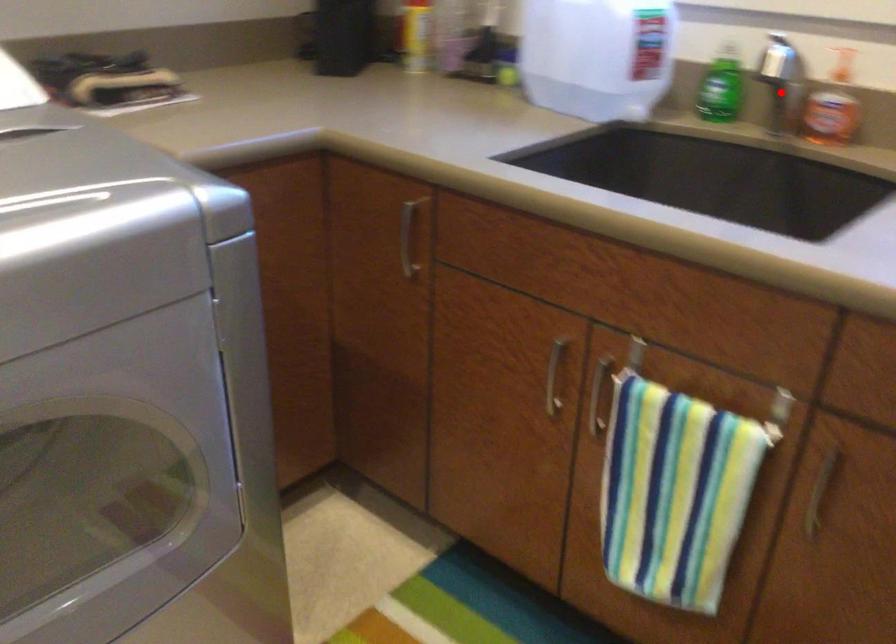
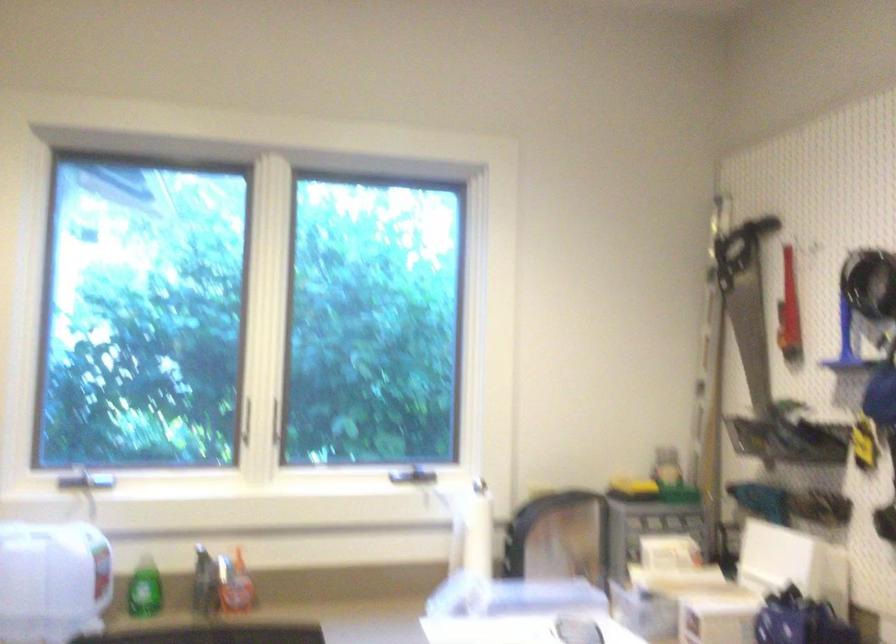
The point at the highlighted location is marked in the first image. Where is the corresponding point in the second image?

(204, 583)